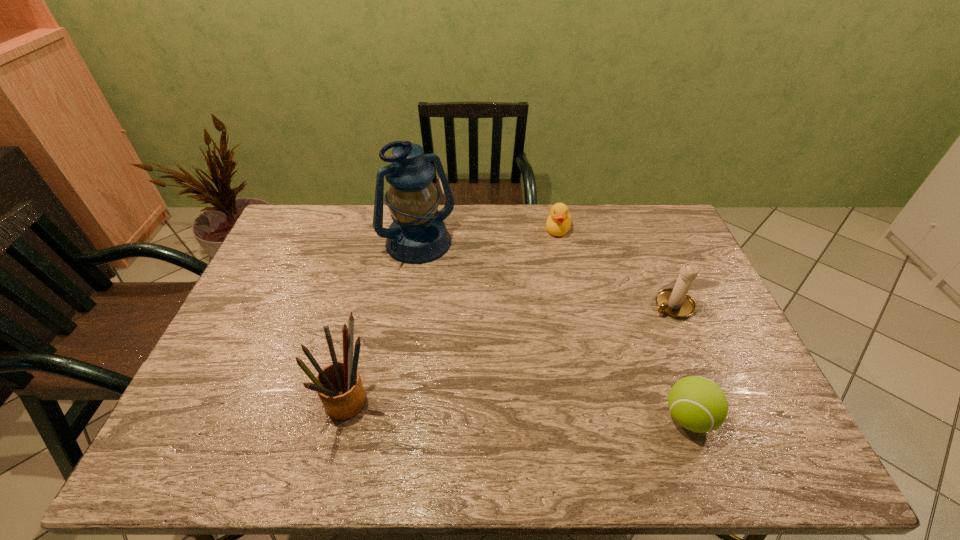
Identify the location of the closest object to the lantern. The width and height of the screenshot is (960, 540). (558, 222).

Locate which object is the closest to the lantern. Please provide its 2D coordinates. Your answer should be formatted as a tuple, i.e. [(x, y)], where the tuple contains the x and y coordinates of a point satisfying the conditions above.

[(558, 222)]

Find the location of a particular element. The image size is (960, 540). free space that satisfies the following two spatial constraints: 1. on the front side of the duckling; 2. on the right side of the tennis ball is located at coordinates (596, 417).